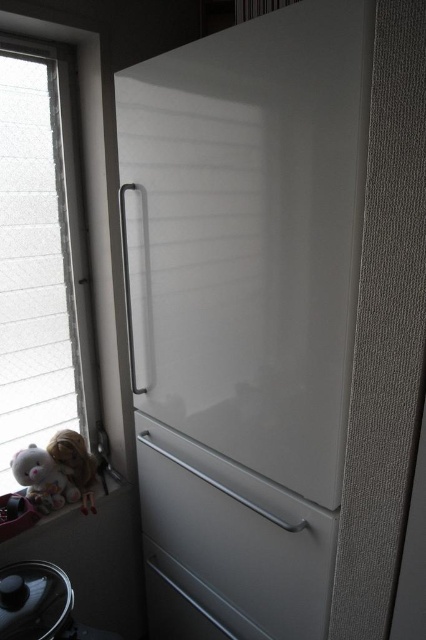
Question: Can you confirm if clear glass window at left is positioned to the right of satin silver drawer at lower center?

Choices:
 (A) yes
 (B) no

Answer: (B)

Question: Is white glossy refrigerator at center below matte plastic doll at lower left?

Choices:
 (A) yes
 (B) no

Answer: (B)

Question: Which of the following is the closest to the observer?

Choices:
 (A) (80, 452)
 (B) (314, 172)

Answer: (B)

Question: Based on their relative distances, which object is farther from the matte black lid at lower left?

Choices:
 (A) white glossy refrigerator at center
 (B) clear glass window at left
 (C) fluffy white teddy bear at lower left

Answer: (B)

Question: Where is clear glass window at left located in relation to fluffy white teddy bear at lower left in the image?

Choices:
 (A) below
 (B) above

Answer: (B)

Question: Which point is farther from the camera taking this photo?

Choices:
 (A) (31, 502)
 (B) (16, 336)
 (C) (34, 513)
 (D) (69, 444)

Answer: (D)